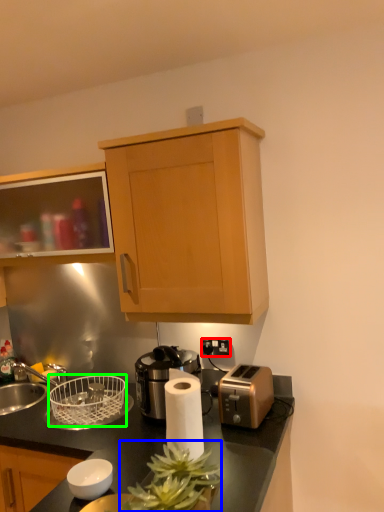
Question: Which object is positioned closest to electric outlet (highlighted by a red box)? Select from plant (highlighted by a blue box) and basket (highlighted by a green box).

Choices:
 (A) plant
 (B) basket

Answer: (B)